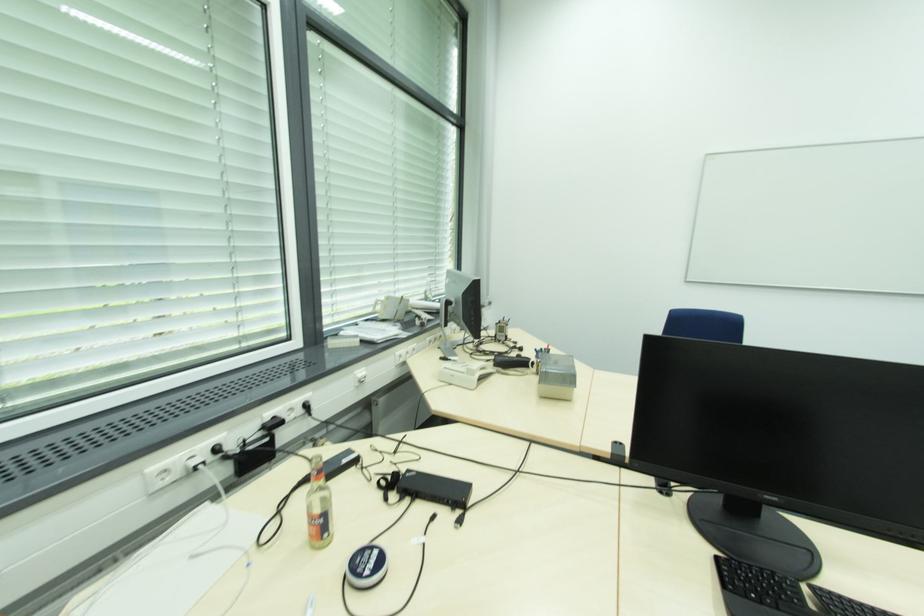
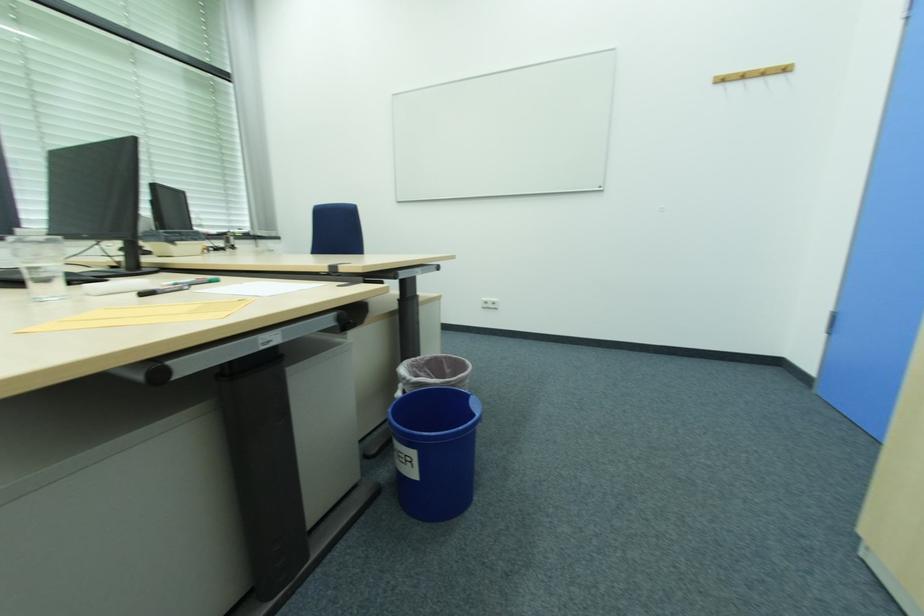
Question: In a continuous first-person perspective shot, in which direction is the camera moving?

Choices:
 (A) Left
 (B) Right
 (C) Forward
 (D) Backward

Answer: (B)